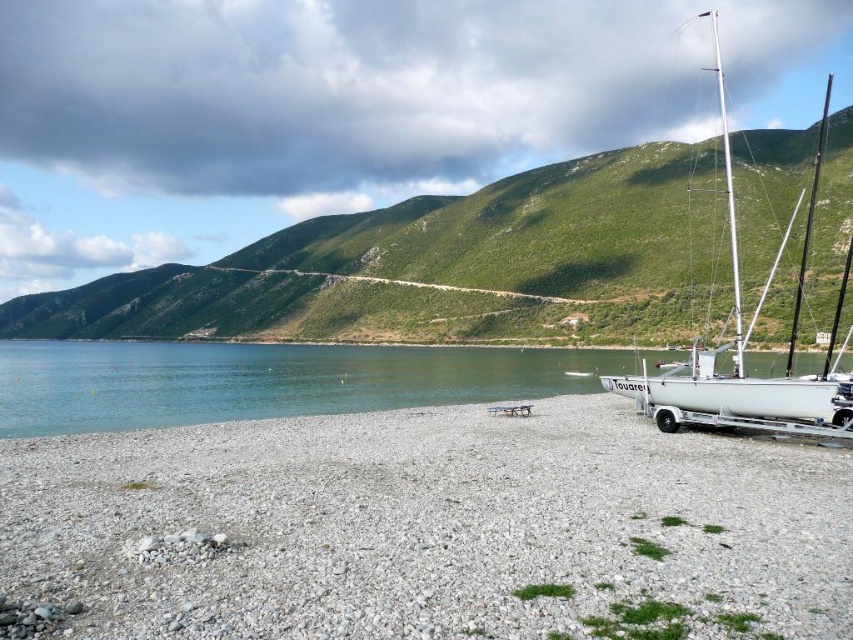
Question: Which object is closer to the camera taking this photo?

Choices:
 (A) white glossy sailboat at right
 (B) gray gravelly sand at lower left

Answer: (B)

Question: Does gray gravelly sand at lower left have a lesser width compared to white glossy sailboat at right?

Choices:
 (A) no
 (B) yes

Answer: (B)

Question: Is gray gravelly sand at lower left further to the viewer compared to white glossy sailboat at right?

Choices:
 (A) no
 (B) yes

Answer: (A)

Question: Which of the following is the farthest from the observer?

Choices:
 (A) (831, 611)
 (B) (834, 412)

Answer: (B)

Question: Which point is farther to the camera?

Choices:
 (A) (750, 384)
 (B) (498, 541)

Answer: (A)

Question: Is gray gravelly sand at lower left bigger than white glossy sailboat at right?

Choices:
 (A) yes
 (B) no

Answer: (B)